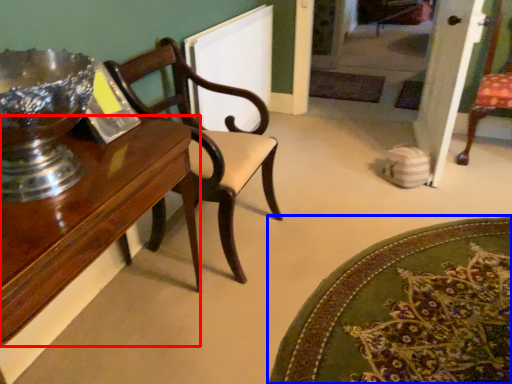
Question: Which object is closer to the camera taking this photo, table (highlighted by a red box) or mat (highlighted by a blue box)?

Choices:
 (A) table
 (B) mat

Answer: (A)